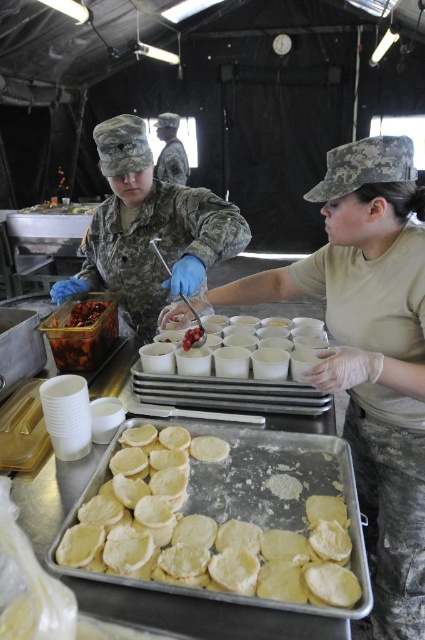
You are a new recruit in this field kitchen. You need to grab a cup from the white matte cups at center while avoiding the camouflage fabric uniform at center. Can you reach the cups without moving the uniform?

The camouflage fabric uniform at center is above the white matte cups at center, so you can reach the cups by moving under the uniform to avoid contact.